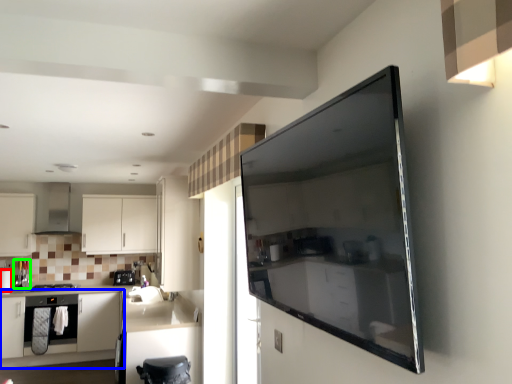
Question: Based on their relative distances, which object is farther from appliance (highlighted by a red box)? Choose from cabinetry (highlighted by a blue box) and appliance (highlighted by a green box).

Choices:
 (A) cabinetry
 (B) appliance

Answer: (A)